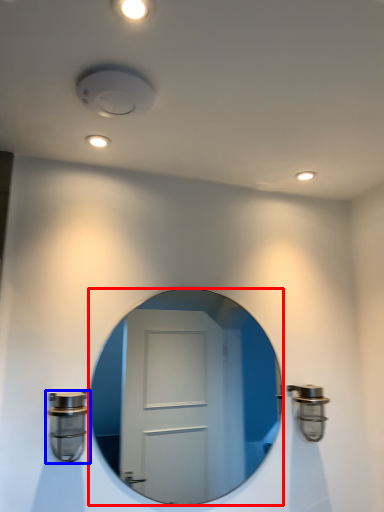
Question: Which point is further to the camera, mirror (highlighted by a red box) or door handle (highlighted by a blue box)?

Choices:
 (A) mirror
 (B) door handle

Answer: (A)